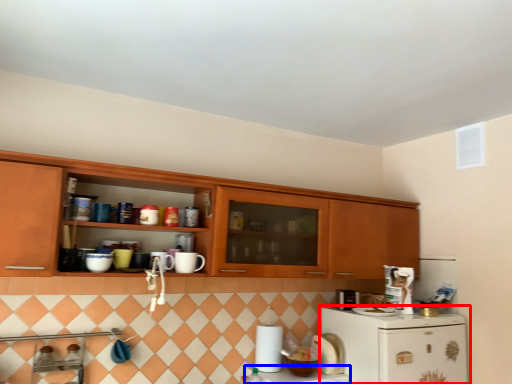
Question: Which object is closer to the camera taking this photo, refrigerator (highlighted by a red box) or counter top (highlighted by a blue box)?

Choices:
 (A) refrigerator
 (B) counter top

Answer: (A)